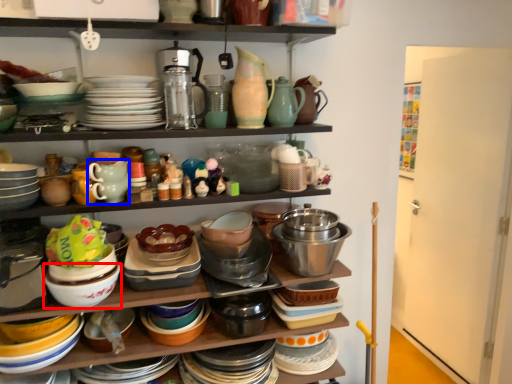
Question: Which of the following is the farthest to the observer, bowl (highlighted by a red box) or tableware (highlighted by a blue box)?

Choices:
 (A) bowl
 (B) tableware

Answer: (B)